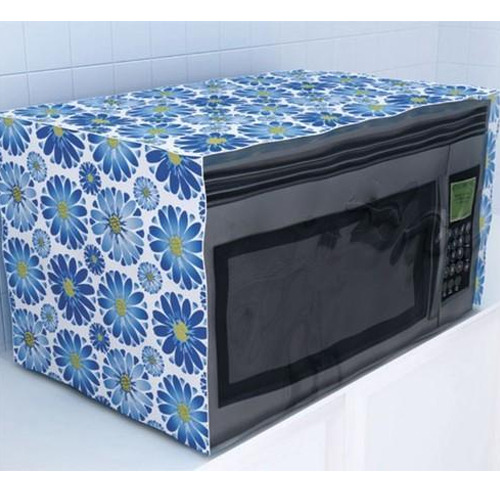
The height and width of the screenshot is (500, 500). Identify the location of tile wall. (157, 52), (465, 47).